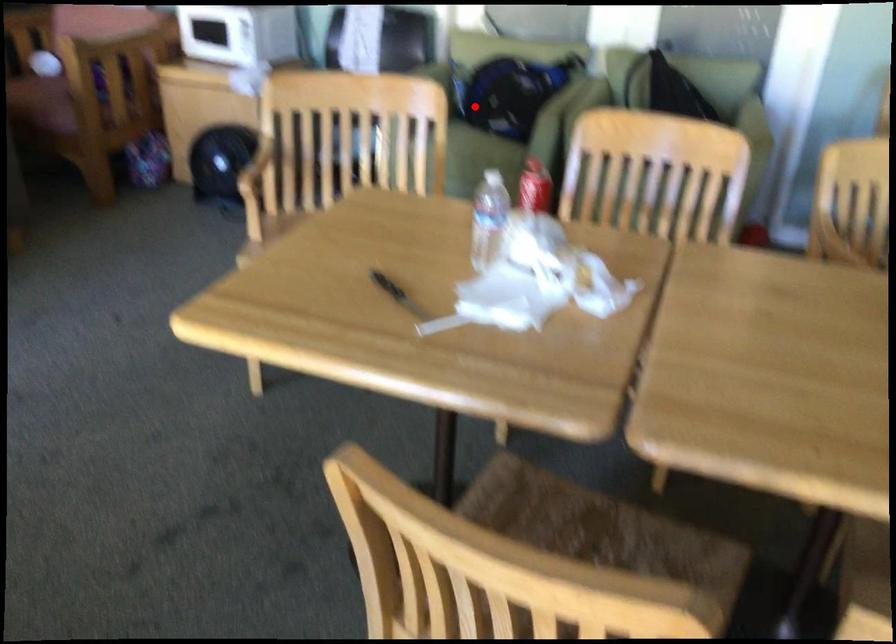
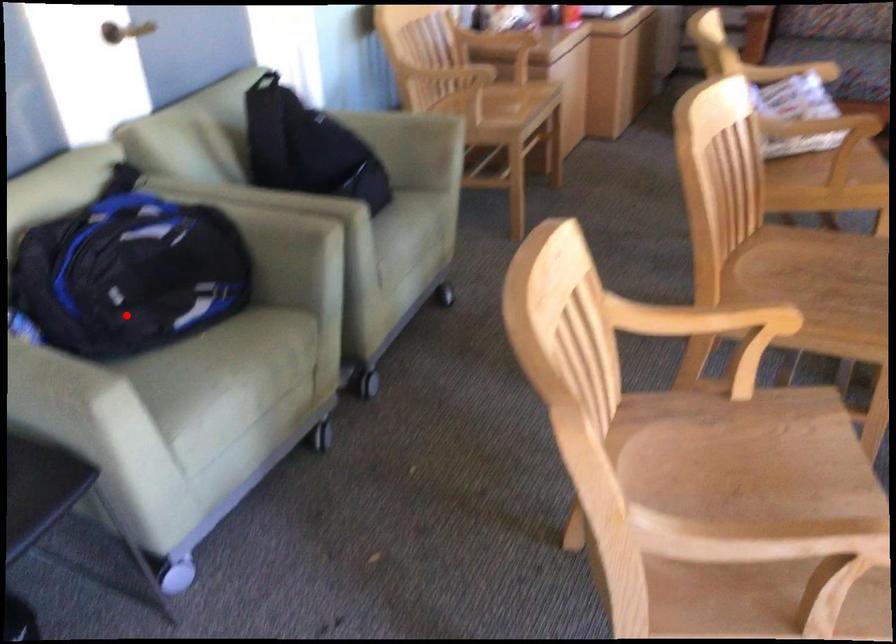
I am providing you with two images of the same scene from different viewpoints. A red point is marked on the first image and another point is marked on the second image. Is the marked point in image1 the same physical position as the marked point in image2?

Yes